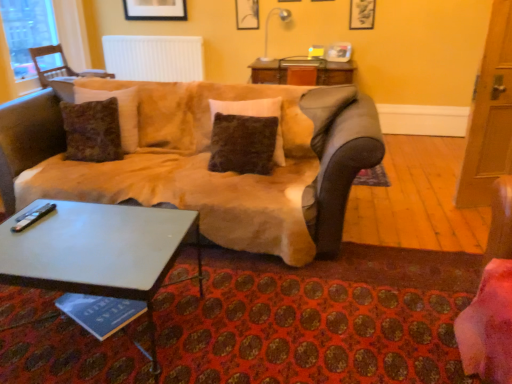
Question: Based on their sizes in the image, would you say white ribbed radiator at upper center is bigger or smaller than matte black picture frame at upper center, the 1th picture frame when ordered from back to front?

Choices:
 (A) big
 (B) small

Answer: (A)

Question: Relative to matte black picture frame at upper center, the 1th picture frame when ordered from left to right, is white ribbed radiator at upper center in front or behind?

Choices:
 (A) behind
 (B) front

Answer: (A)

Question: Which object is positioned closest to the white glossy lamp at upper center?

Choices:
 (A) transparent glass window at upper left
 (B) fuzzy brown pillow at center
 (C) suede-like beige couch at center
 (D) white glossy coffee table at lower left
 (E) white ribbed radiator at upper center

Answer: (E)

Question: Estimate the real-world distances between objects in this image. Which object is closer to the wooden chair at left?

Choices:
 (A) suede-like beige couch at center
 (B) white glossy coffee table at lower left
 (C) transparent glass window at upper left
 (D) matte black picture frame at upper center, the 1th picture frame when ordered from back to front
 (E) fuzzy brown pillow at center

Answer: (C)